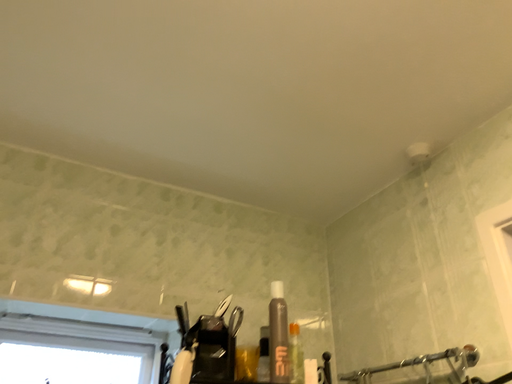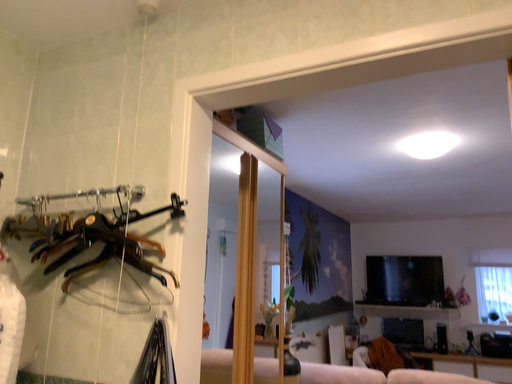
Question: Which way did the camera rotate in the video?

Choices:
 (A) rotated upward
 (B) rotated downward

Answer: (B)